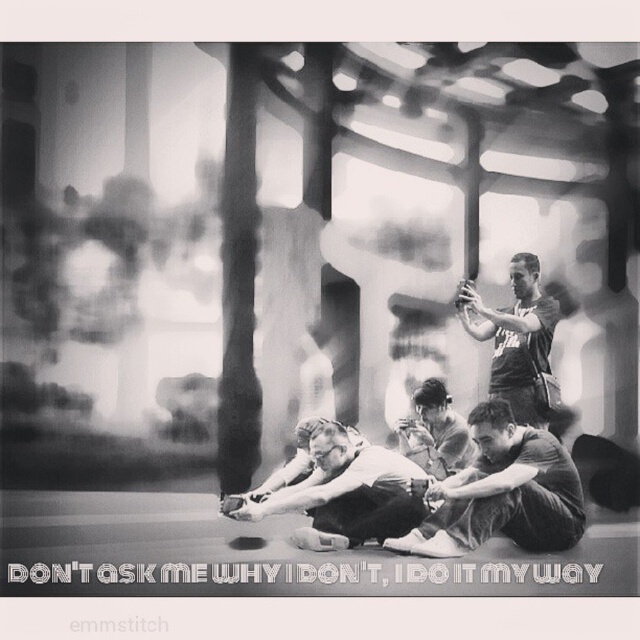
You are a photographer trying to capture a closeup of the smooth fabric shirt at center without including the dark gray fabric shirt at lower right in the frame. Based on their positions, is this possible?

The dark gray fabric shirt at lower right is positioned on the right side of smooth fabric shirt at center, so if you position your camera to the left of the smooth fabric shirt at center, you can capture it without including the dark gray fabric shirt at lower right.

You are standing at the entrance of the room and notice the dark gray fabric shirt at lower right. If you want to reach it by walking straight ahead, will you encounter any obstacles in your path?

The dark gray fabric shirt at lower right is located at point (x=502, y=492), which means it is positioned towards the lower right corner of the image. Since the individuals in the foreground are seated on the floor near the center and the entrance is likely at a different area, your straight path might not directly lead to it without navigating around the seated people. However, without specific obstacle data, it is difficult to confirm. But according to the coordinates, it is placed in an open area, so you